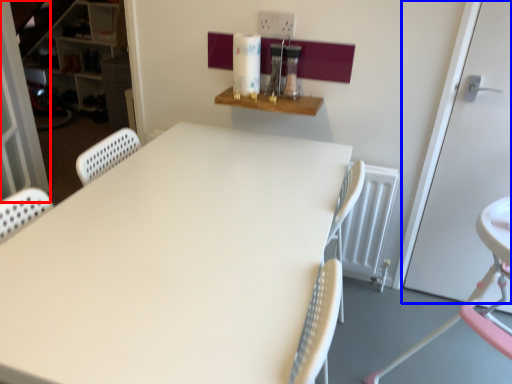
Question: Among these objects, which one is farthest to the camera, screen door (highlighted by a red box) or door (highlighted by a blue box)?

Choices:
 (A) screen door
 (B) door

Answer: (A)